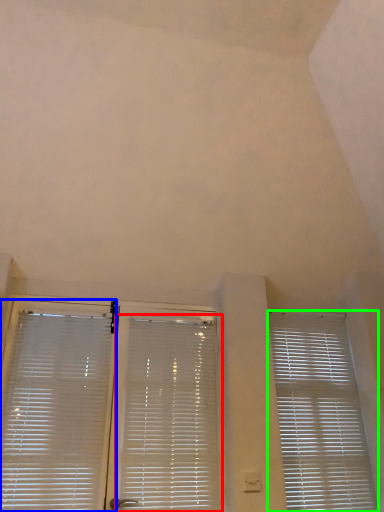
Question: Considering the real-world distances, which object is closest to window blind (highlighted by a red box)? window blind (highlighted by a blue box) or window blind (highlighted by a green box).

Choices:
 (A) window blind
 (B) window blind

Answer: (A)